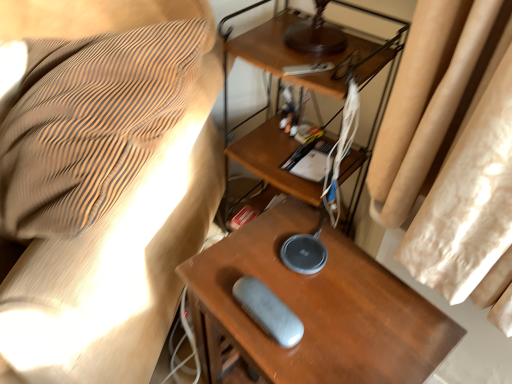
Locate an element on the screen. This screenshot has width=512, height=384. free space to the back side of gray matte speaker at center is located at coordinates (276, 252).